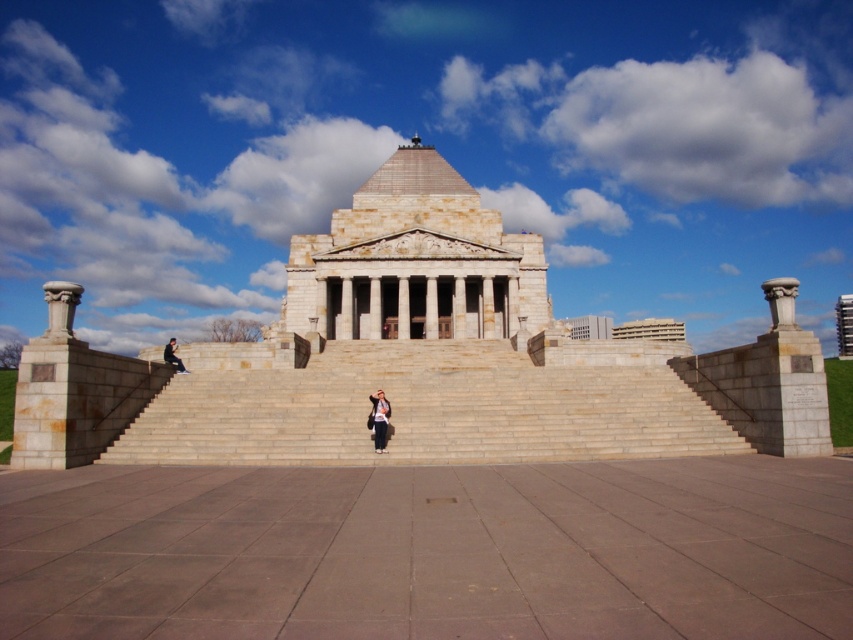
Is beige stone stairs at center closer to camera compared to smooth stone column at right?

Yes, it is.

Locate an element on the screen. beige stone stairs at center is located at coordinates (424, 417).

Locate an element on the screen. The height and width of the screenshot is (640, 853). beige stone stairs at center is located at coordinates (424, 417).

Is smooth stone column at right behind denim jacket at center?

No, smooth stone column at right is closer to the viewer.

Is smooth stone column at right to the left of denim jacket at center from the viewer's perspective?

In fact, smooth stone column at right is to the right of denim jacket at center.

Identify the location of smooth stone column at right. (781, 301).

Does white stone column at left lie behind smooth stone column at right?

No.

This screenshot has height=640, width=853. Describe the element at coordinates (61, 307) in the screenshot. I see `white stone column at left` at that location.

Who is more forward, (67, 284) or (775, 324)?

Point (67, 284)

Where is `white stone column at left`? This screenshot has height=640, width=853. white stone column at left is located at coordinates (61, 307).